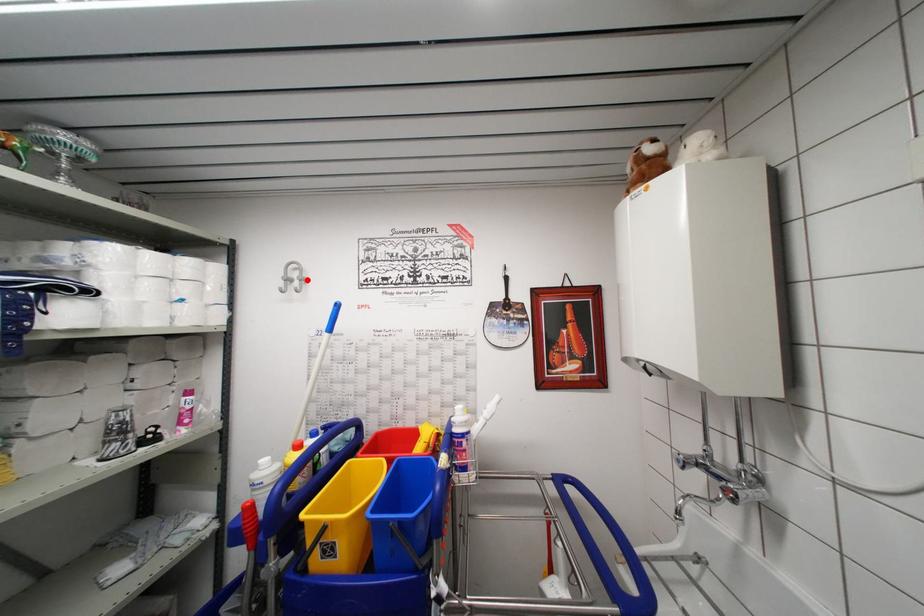
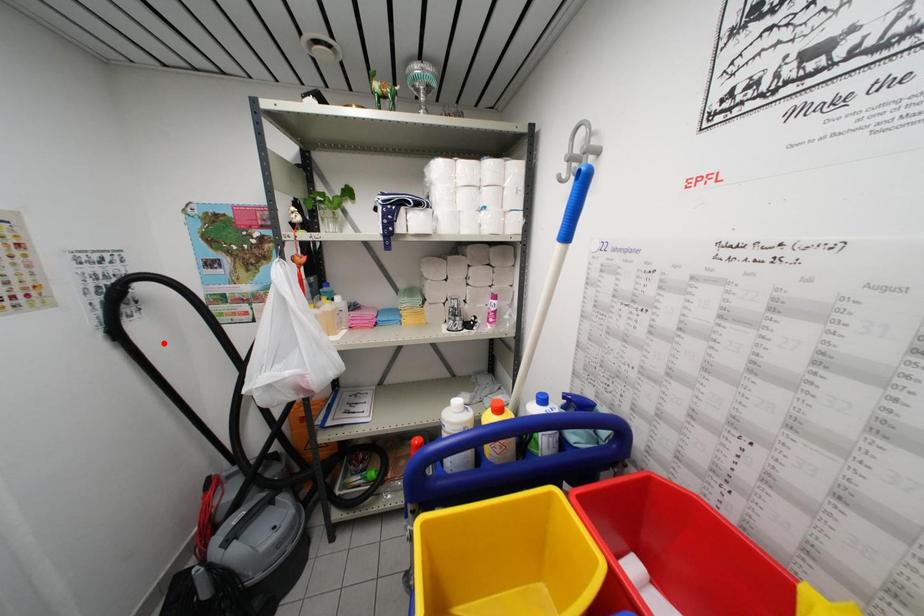
I am providing you with two images of the same scene from different viewpoints. A red point is marked on the first image and another point is marked on the second image. Are the points marked in image1 and image2 representing the same 3D position?

No